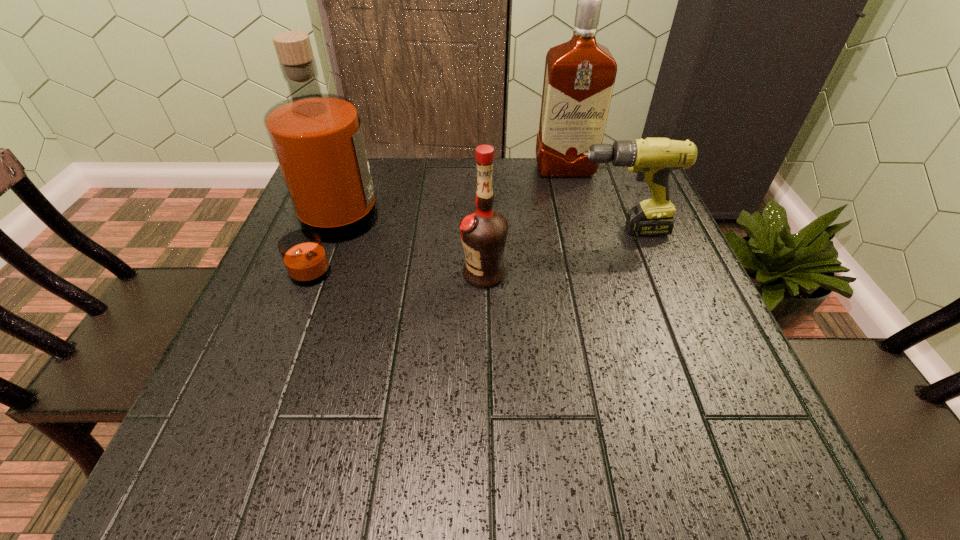
Locate an element on the screen. This screenshot has width=960, height=540. vacant space located on the front and back of the second shortest object is located at coordinates (284, 273).

This screenshot has width=960, height=540. What are the coordinates of `vacant space situated 0.090m on the handle side of the shortest object` in the screenshot? It's located at click(530, 231).

You are a GUI agent. You are given a task and a screenshot of the screen. Output one action in this format:
    pyautogui.click(x=<x>, y=<y>)
    Task: Click on the vacant space located on the handle side of the shortest object
    
    Given the screenshot: What is the action you would take?
    coord(535,231)

Find the location of a particular element. Image resolution: width=960 pixels, height=540 pixels. blank area located 0.250m on the handle side of the shortest object is located at coordinates (461, 231).

Locate an element on the screen. This screenshot has height=540, width=960. object that is positioned at the left edge is located at coordinates (317, 138).

This screenshot has height=540, width=960. Identify the location of liquor at the right edge. (579, 77).

Where is `drill at the right edge`? This screenshot has width=960, height=540. drill at the right edge is located at coordinates (653, 159).

I want to click on object present at the far left corner, so click(x=317, y=138).

Where is `object situated at the far right corner`? object situated at the far right corner is located at coordinates (579, 77).

Where is `vacant position at the far edge of the desktop`? The width and height of the screenshot is (960, 540). vacant position at the far edge of the desktop is located at coordinates (425, 184).